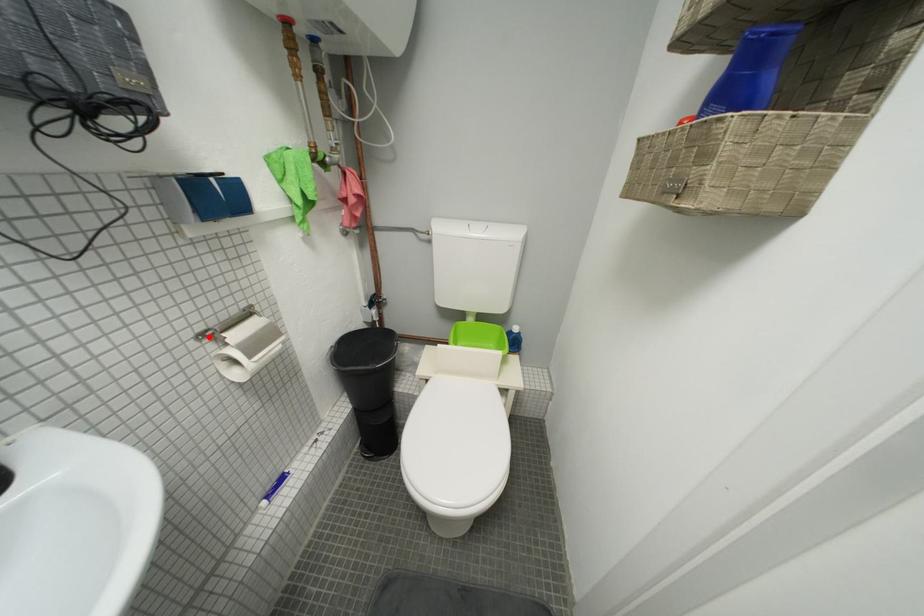
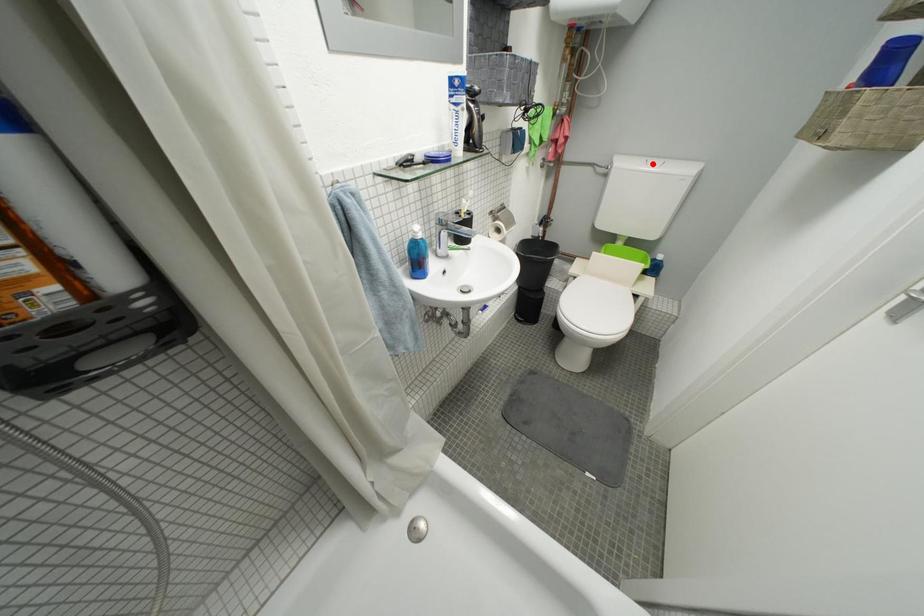
I am providing you with two images of the same scene from different viewpoints. A red point is marked on the first image and another point is marked on the second image. Are the points marked in image1 and image2 representing the same 3D position?

No